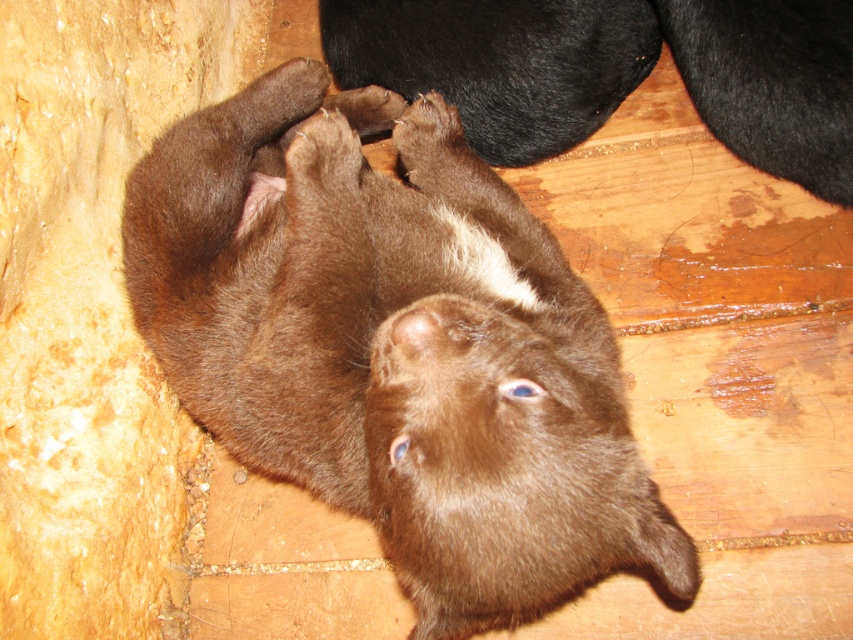
Can you confirm if brown furry bear cub at center is positioned to the left of brown fur at upper center?

Indeed, brown furry bear cub at center is positioned on the left side of brown fur at upper center.

Which of these two, brown furry bear cub at center or brown fur at upper center, stands taller?

brown furry bear cub at center is taller.

Where is `brown furry bear cub at center`? This screenshot has height=640, width=853. brown furry bear cub at center is located at coordinates (393, 346).